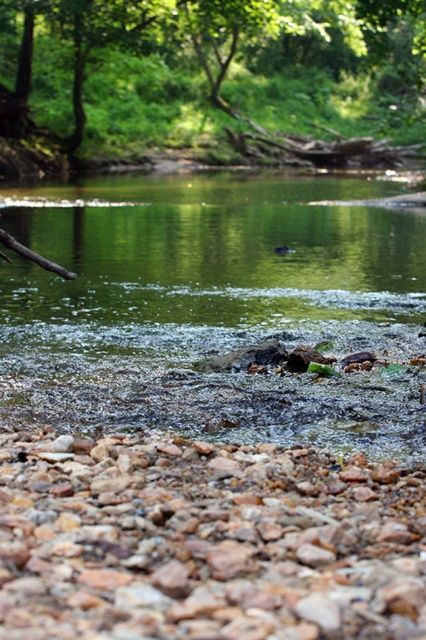
Can you confirm if rusty gravel rocks at lower center is positioned above green leafy tree at upper center?

Incorrect, rusty gravel rocks at lower center is not positioned above green leafy tree at upper center.

Which is behind, point (14, 628) or point (36, 154)?

The point (36, 154) is behind.

The image size is (426, 640). What are the coordinates of `rusty gravel rocks at lower center` in the screenshot? It's located at (206, 541).

Which is above, green mossy rock at center or rusty gravel rocks at lower center?

Positioned higher is green mossy rock at center.

You are a GUI agent. You are given a task and a screenshot of the screen. Output one action in this format:
    pyautogui.click(x=<x>, y=<y>)
    Task: Click on the green mossy rock at center
    
    Given the screenshot: What is the action you would take?
    (x=213, y=307)

Which is in front, point (46, 193) or point (175, 563)?

Point (175, 563) is in front.

The width and height of the screenshot is (426, 640). What are the coordinates of `green mossy rock at center` in the screenshot? It's located at (213, 307).

Between point (417, 326) and point (163, 86), which one is positioned in front?

Point (417, 326)

Does green mossy rock at center have a smaller size compared to green leafy tree at upper center?

Correct, green mossy rock at center occupies less space than green leafy tree at upper center.

The height and width of the screenshot is (640, 426). Find the location of `green mossy rock at center`. green mossy rock at center is located at coordinates (213, 307).

The width and height of the screenshot is (426, 640). Identify the location of green mossy rock at center. (213, 307).